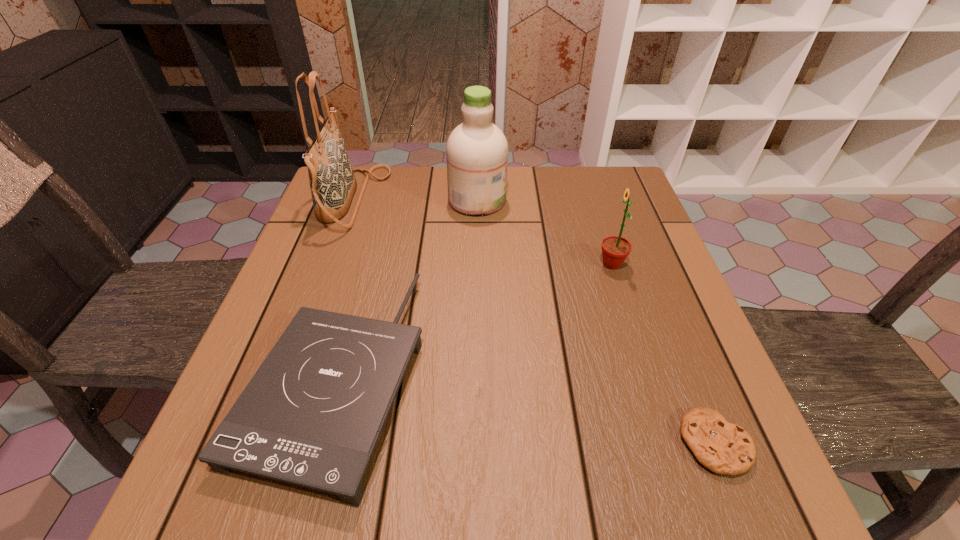
This screenshot has width=960, height=540. I want to click on cookie that is at the right edge, so click(x=724, y=448).

Find the location of a particular element. The image size is (960, 540). object present at the far left corner is located at coordinates (332, 181).

The width and height of the screenshot is (960, 540). Find the location of `object present at the near left corner`. object present at the near left corner is located at coordinates 312,414.

In order to click on object that is positioned at the near right corner in this screenshot , I will do `click(724, 448)`.

The height and width of the screenshot is (540, 960). Identify the location of free space at the far edge. (534, 187).

Find the location of a particular element. vacant space at the left edge is located at coordinates (321, 238).

Image resolution: width=960 pixels, height=540 pixels. I want to click on blank space at the right edge of the desktop, so click(646, 258).

In the image, there is a desktop. Where is `vacant space at the far right corner`? vacant space at the far right corner is located at coordinates (585, 195).

Where is `vacant space at the near right corner`? This screenshot has width=960, height=540. vacant space at the near right corner is located at coordinates (693, 458).

Image resolution: width=960 pixels, height=540 pixels. I want to click on empty space between the cleansing agent and the hotplate, so click(407, 287).